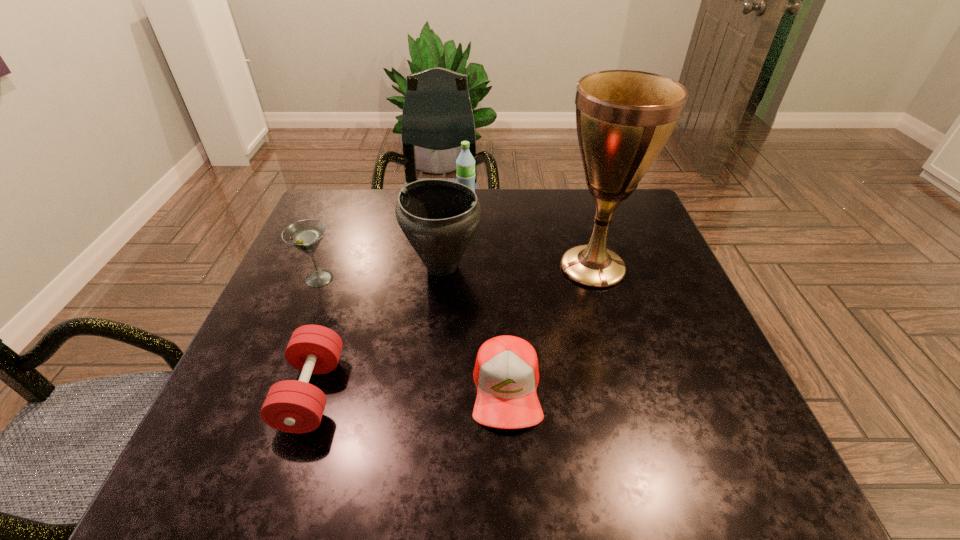
In the image, there is a desktop. Identify the location of vacant area at the near edge. The image size is (960, 540). (373, 468).

Image resolution: width=960 pixels, height=540 pixels. In order to click on free space at the left edge of the desktop in this screenshot , I will do `click(327, 244)`.

Identify the location of vacant region at the far left corner of the desktop. (338, 205).

The image size is (960, 540). Identify the location of vacant area at the near left corner. (218, 466).

In the image, there is a desktop. Where is `vacant space at the far right corner`? Image resolution: width=960 pixels, height=540 pixels. vacant space at the far right corner is located at coordinates (589, 207).

The image size is (960, 540). Identify the location of free spot at the near right corner of the desktop. (743, 483).

Where is `empty location between the dumbbell and the baseball cap`? empty location between the dumbbell and the baseball cap is located at coordinates (409, 390).

Identify the location of vacant space that's between the dumbbell and the urn. (377, 329).

What are the coordinates of `vacant space in between the rightmost object and the baseball cap` in the screenshot? It's located at (550, 328).

Identify the location of free area in between the farthest object and the third shortest object. The image size is (960, 540). (393, 241).